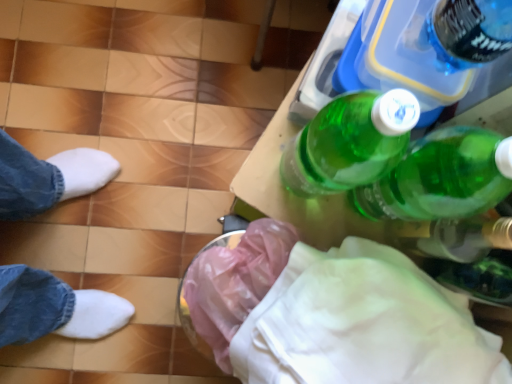
This screenshot has height=384, width=512. What do you see at coordinates (234, 282) in the screenshot?
I see `pink plastic bag at lower center` at bounding box center [234, 282].

Measure the distance between green plastic bottle at upper right and camera.

The depth of green plastic bottle at upper right is 13.58 inches.

This screenshot has width=512, height=384. I want to click on green plastic bottle at upper right, so click(424, 48).

What do you see at coordinates (362, 324) in the screenshot? The image size is (512, 384). I see `white fabric at lower right` at bounding box center [362, 324].

Identify the location of white fabric at lower right. The height and width of the screenshot is (384, 512). (362, 324).

Image resolution: width=512 pixels, height=384 pixels. Find the location of `pink plastic bag at lower center`. pink plastic bag at lower center is located at coordinates (234, 282).

Looking at this image, is green plastic bottle at upper right aimed at white fabric at lower right?

Yes, green plastic bottle at upper right is turned towards white fabric at lower right.

From the image's perspective, is green plastic bottle at upper right below white fabric at lower right?

No, from the image's perspective, green plastic bottle at upper right is not below white fabric at lower right.

Can you confirm if green plastic bottle at upper right is positioned to the left of white fabric at lower right?

No, green plastic bottle at upper right is not to the left of white fabric at lower right.

From the image's perspective, which one is positioned higher, green plastic bottle at upper right or pink plastic bag at lower center?

From the image's view, green plastic bottle at upper right is above.

Image resolution: width=512 pixels, height=384 pixels. Find the location of `bottle lying in front of the pink plastic bag at lower center`. bottle lying in front of the pink plastic bag at lower center is located at coordinates (424, 48).

Can you tell me how much green plastic bottle at upper right and pink plastic bag at lower center differ in facing direction?

The angle between the facing direction of green plastic bottle at upper right and the facing direction of pink plastic bag at lower center is 61 degrees.

From their relative heights in the image, would you say green plastic bottle at upper right is taller or shorter than pink plastic bag at lower center?

Clearly, green plastic bottle at upper right is shorter compared to pink plastic bag at lower center.

Is transparent plastic bottle at lower right touching white fabric at lower right?

No, transparent plastic bottle at lower right is not making contact with white fabric at lower right.

Which of these two, transparent plastic bottle at lower right or white fabric at lower right, is thinner?

With smaller width is transparent plastic bottle at lower right.

Choose the correct answer: Is transparent plastic bottle at lower right inside white fabric at lower right or outside it?

The correct answer is: inside.

Is white fabric at lower right not close to transparent plastic bottle at lower right?

Actually, white fabric at lower right and transparent plastic bottle at lower right are a little close together.

Is white fabric at lower right wider than transparent plastic bottle at lower right?

Yes.

How distant is white fabric at lower right from transparent plastic bottle at lower right?

white fabric at lower right is 5.37 inches away from transparent plastic bottle at lower right.

Can you confirm if green plastic bottle at upper right is taller than transparent plastic bottle at lower right?

No, green plastic bottle at upper right is not taller than transparent plastic bottle at lower right.

From the image's perspective, is green plastic bottle at upper right positioned above or below transparent plastic bottle at lower right?

From the image's perspective, green plastic bottle at upper right appears above transparent plastic bottle at lower right.

From a real-world perspective, is green plastic bottle at upper right located beneath transparent plastic bottle at lower right?

Incorrect, from a real-world perspective, green plastic bottle at upper right is higher than transparent plastic bottle at lower right.

From a real-world perspective, between transparent plastic bottle at lower right and green plastic bottle at upper right, who is vertically lower?

From a 3D spatial view, transparent plastic bottle at lower right is below.

Considering the relative positions of transparent plastic bottle at lower right and green plastic bottle at upper right in the image provided, is transparent plastic bottle at lower right to the right of green plastic bottle at upper right from the viewer's perspective?

Yes.

Is transparent plastic bottle at lower right facing towards green plastic bottle at upper right?

No, transparent plastic bottle at lower right is not oriented towards green plastic bottle at upper right.

Between pink plastic bag at lower center and green plastic bottle at upper right, which one has less height?

Standing shorter between the two is green plastic bottle at upper right.

Looking at their sizes, would you say pink plastic bag at lower center is wider or thinner than green plastic bottle at upper right?

Clearly, pink plastic bag at lower center has less width compared to green plastic bottle at upper right.

What's the angular difference between pink plastic bag at lower center and green plastic bottle at upper right's facing directions?

There is a 61-degree angle between the facing directions of pink plastic bag at lower center and green plastic bottle at upper right.

Image resolution: width=512 pixels, height=384 pixels. What are the coordinates of `bottle above the white fabric at lower right (from the image's perspective)` in the screenshot? It's located at (424, 48).

Where is `bottle in front of the pink plastic bag at lower center`? Image resolution: width=512 pixels, height=384 pixels. bottle in front of the pink plastic bag at lower center is located at coordinates click(x=424, y=48).

Which object lies nearer to the anchor point pink plastic bag at lower center, green plastic bottle at upper right or white fabric at lower right?

white fabric at lower right lies closer to pink plastic bag at lower center than the other object.

Based on their spatial positions, is transparent plastic bottle at lower right or green plastic bottle at upper right closer to pink plastic bag at lower center?

transparent plastic bottle at lower right.

From the image, which object appears to be nearer to green plastic bottle at upper right, pink plastic bag at lower center or white fabric at lower right?

white fabric at lower right.

Which object lies nearer to the anchor point green plastic bottle at upper right, white fabric at lower right or transparent plastic bottle at lower right?

transparent plastic bottle at lower right is closer to green plastic bottle at upper right.

From the image, which object appears to be farther from transparent plastic bottle at lower right, pink plastic bag at lower center or white fabric at lower right?

pink plastic bag at lower center is further to transparent plastic bottle at lower right.

Looking at the image, which one is located further to green plastic bottle at upper right, white fabric at lower right or pink plastic bag at lower center?

Among the two, pink plastic bag at lower center is located further to green plastic bottle at upper right.

Considering their positions, is green plastic bottle at upper right positioned closer to white fabric at lower right than pink plastic bag at lower center?

pink plastic bag at lower center lies closer to white fabric at lower right than the other object.

Which object lies nearer to the anchor point pink plastic bag at lower center, white fabric at lower right or transparent plastic bottle at lower right?

Based on the image, white fabric at lower right appears to be nearer to pink plastic bag at lower center.

You are a GUI agent. You are given a task and a screenshot of the screen. Output one action in this format:
    pyautogui.click(x=<x>, y=<y>)
    Task: Click on the glass bottle between green plastic bottle at upper right and pink plastic bag at lower center vertically
    This screenshot has width=512, height=384.
    Given the screenshot: What is the action you would take?
    [x=477, y=277]

Find the location of `cloth situated between pink plastic bag at lower center and transparent plastic bottle at lower right from left to right`. cloth situated between pink plastic bag at lower center and transparent plastic bottle at lower right from left to right is located at coordinates (362, 324).

The width and height of the screenshot is (512, 384). What are the coordinates of `glass bottle between green plastic bottle at upper right and white fabric at lower right from top to bottom` in the screenshot? It's located at click(x=477, y=277).

Image resolution: width=512 pixels, height=384 pixels. In order to click on material between green plastic bottle at upper right and white fabric at lower right from top to bottom in this screenshot , I will do `click(234, 282)`.